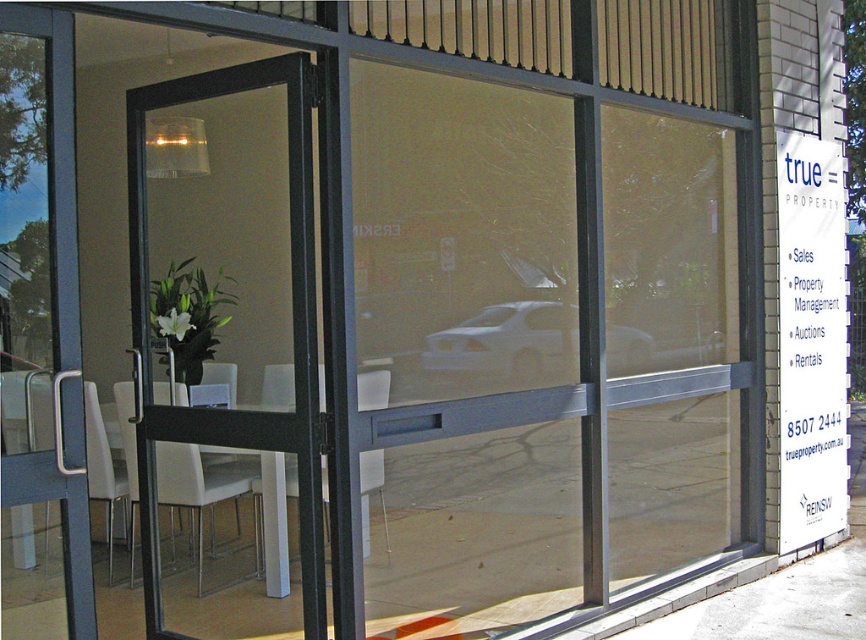
You are a delivery person trying to enter the building through the black glass screen door at center. There is a white plastic chair at center in the way. Can you walk through the space between them?

The white plastic chair at center is behind the black glass screen door at center, so there is no space between them for you to walk through.

You are standing at the entrance of the modern building and want to walk towards the point marked as point [308,508]. However, there is an obstacle at point [167,484]. Will you be able to reach your destination without going around the obstacle?

Since point [308,508] is in front of point [167,484], you can reach the destination without going around the obstacle as it is closer to you than the obstacle.